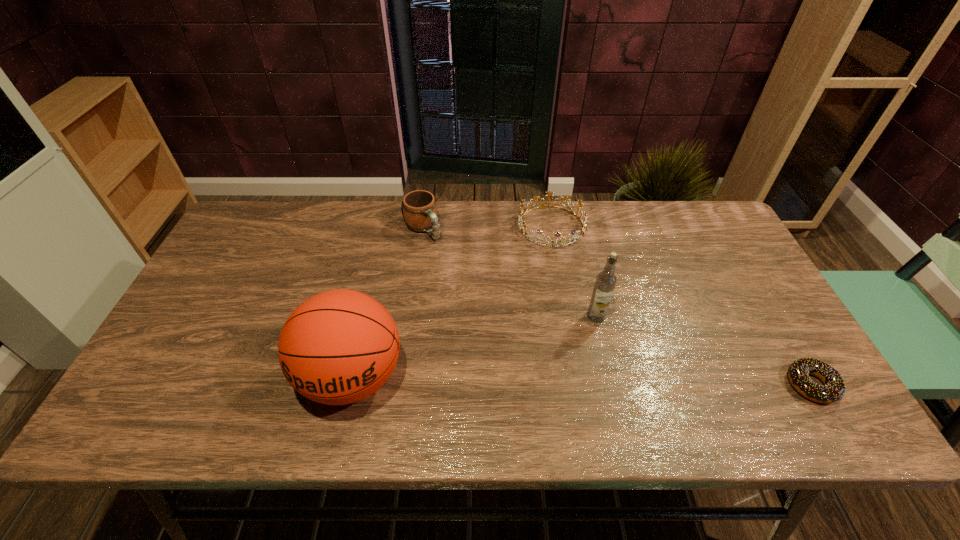
Image resolution: width=960 pixels, height=540 pixels. In order to click on object that is positioned at the right edge in this screenshot , I will do `click(834, 389)`.

Find the location of a particular element. Image resolution: width=960 pixels, height=540 pixels. object that is at the near right corner is located at coordinates (834, 389).

Find the location of a particular element. Image resolution: width=960 pixels, height=540 pixels. free space at the far edge of the desktop is located at coordinates (589, 207).

Where is `free space at the near edge of the desktop`? free space at the near edge of the desktop is located at coordinates (228, 393).

Identify the location of free location at the right edge of the desktop. (722, 282).

The width and height of the screenshot is (960, 540). Find the location of `vacant space at the far left corner of the desktop`. vacant space at the far left corner of the desktop is located at coordinates (273, 206).

In the image, there is a desktop. At what (x,y) coordinates should I click in order to perform the action: click on vacant space at the far right corner. Please return your answer as a coordinate pair (x, y). The width and height of the screenshot is (960, 540). Looking at the image, I should click on (699, 246).

At what (x,y) coordinates should I click in order to perform the action: click on vacant area that lies between the third shortest object and the shortest object. Please return your answer as a coordinate pair (x, y). This screenshot has height=540, width=960. Looking at the image, I should click on (617, 307).

What are the coordinates of `free area in between the vodka and the shortest object` in the screenshot? It's located at pos(704,350).

In order to click on unoccupied area between the basketball and the third farthest object in this screenshot , I will do `click(474, 347)`.